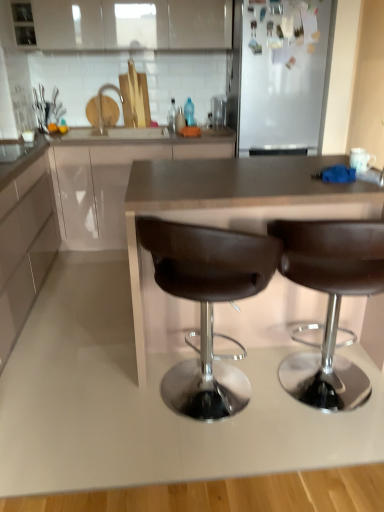
The image size is (384, 512). I want to click on vacant region to the left of brushed metal faucet at upper center, so click(91, 131).